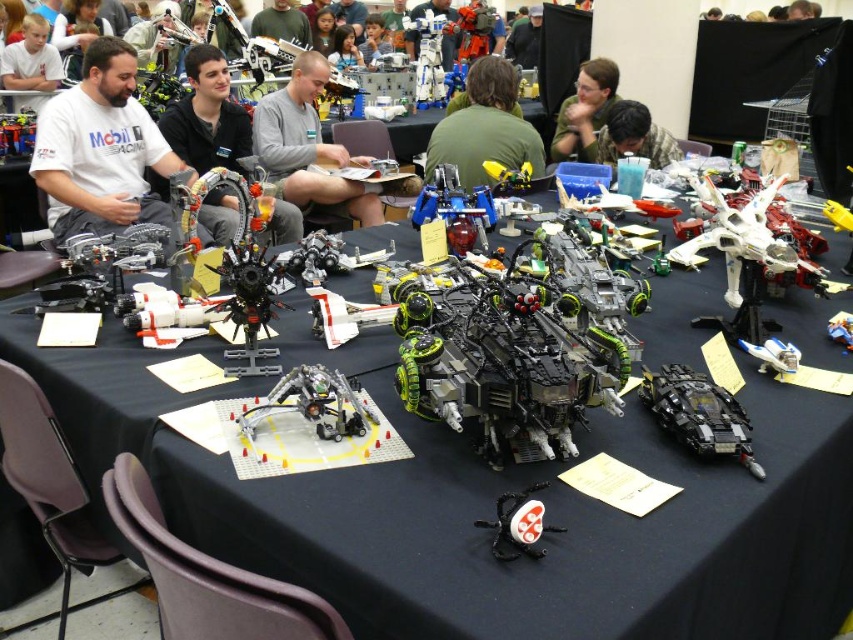
You are a photographer at the LEGO convention and want to capture a photo of the blue metallic spaceship at lower right without any people blocking it. Since the green matte shirt at center is in the way, where should you position yourself to take the photo?

The blue metallic spaceship at lower right is behind the green matte shirt at center, so you should move behind the green matte shirt at center to take the photo without any obstruction.

You are at a LEGO exhibition and want to take a photo of both the point at coordinates point (407,32) and point (538,22). Which point should you focus on first to ensure both are in focus?

Point (407,32) is closer to the viewer than point (538,22), so you should focus on point (407,32) first to ensure both are in focus.

You are a photographer at the LEGO convention. You want to take a photo of the black plastic table at center and the green matte shirt at upper center in the same frame. Your camera has a maximum focus range of 7 feet. Will you be able to capture both in focus without moving your position?

The distance between the black plastic table at center and the green matte shirt at upper center is 6.73 feet, which is within the camera maximum focus range of 7 feet. Therefore, you can capture both in focus without moving your position.